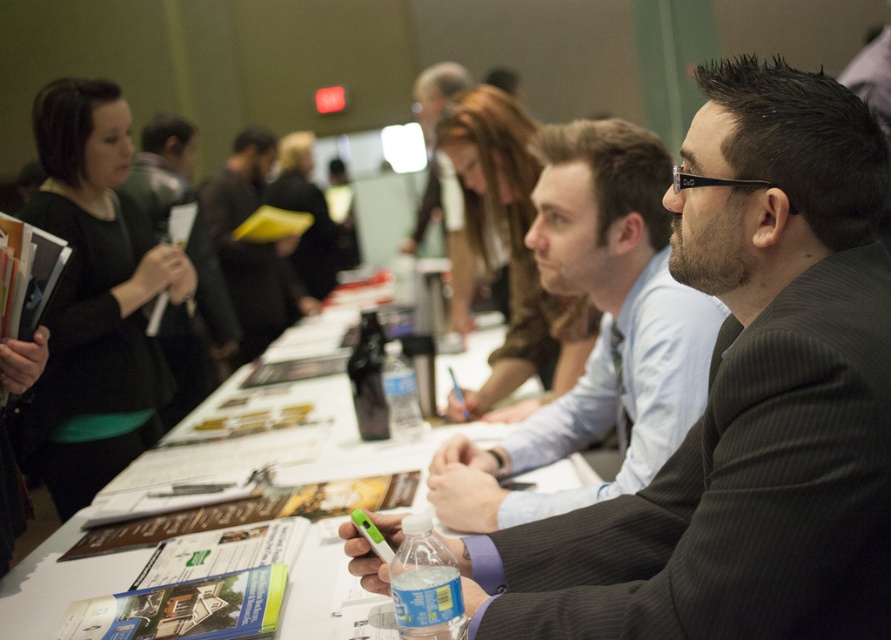
In the scene shown: Does matte black jacket at center have a greater width compared to clear plastic water bottle at center?

Correct, the width of matte black jacket at center exceeds that of clear plastic water bottle at center.

Describe the element at coordinates (252, 246) in the screenshot. I see `matte black jacket at center` at that location.

Who is more distant from viewer, (285, 257) or (399, 365)?

The point (285, 257) is more distant.

I want to click on matte black jacket at center, so (x=252, y=246).

From the picture: Between black suit at center and white paper at center, which one is positioned lower?

white paper at center is lower down.

Describe the element at coordinates (745, 401) in the screenshot. The width and height of the screenshot is (891, 640). I see `black suit at center` at that location.

This screenshot has height=640, width=891. Find the location of `black suit at center`. black suit at center is located at coordinates (745, 401).

Find the location of a particular element. black suit at center is located at coordinates (745, 401).

Between black suit at center and translucent plastic water bottle at center, which one is positioned higher?

black suit at center is higher up.

Can you confirm if black suit at center is thinner than translucent plastic water bottle at center?

In fact, black suit at center might be wider than translucent plastic water bottle at center.

Where is `black suit at center`? Image resolution: width=891 pixels, height=640 pixels. black suit at center is located at coordinates (745, 401).

Where is `black suit at center`? black suit at center is located at coordinates (745, 401).